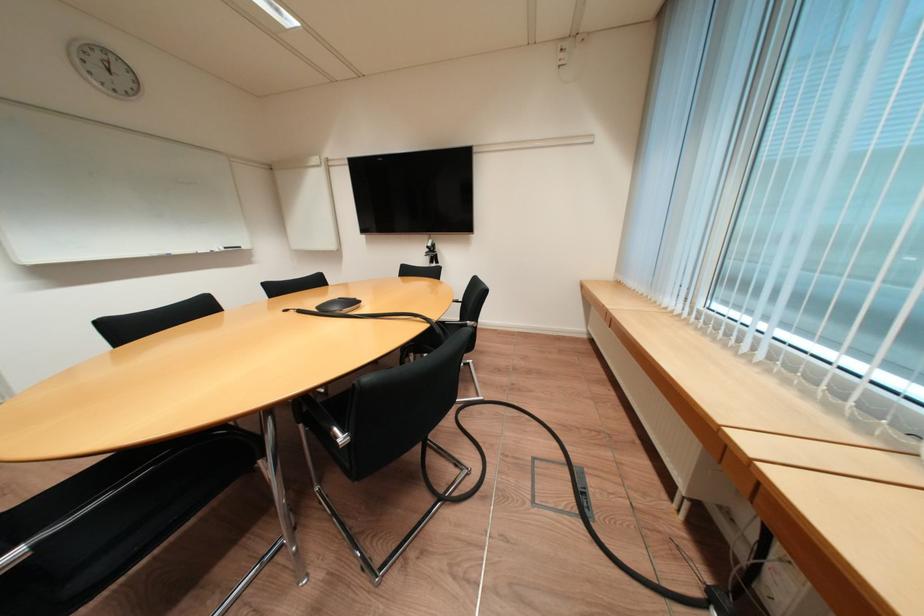
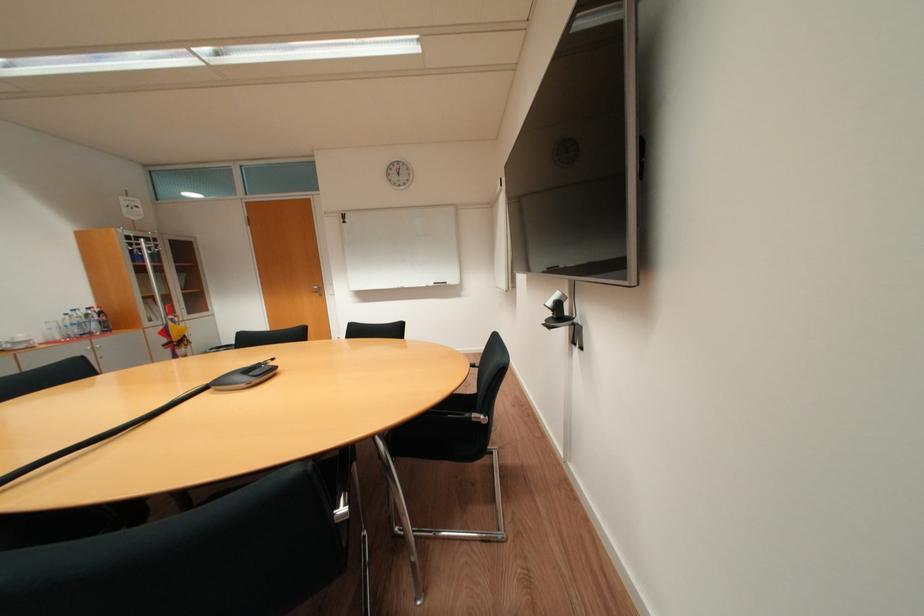
In the second image, find the point that corresponds to pixel 439 246 in the first image.

(558, 304)